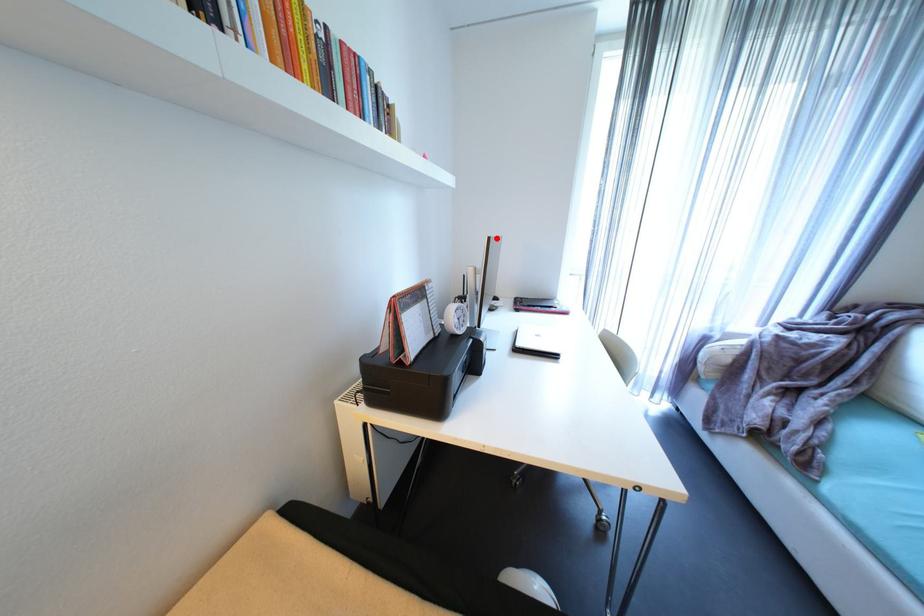
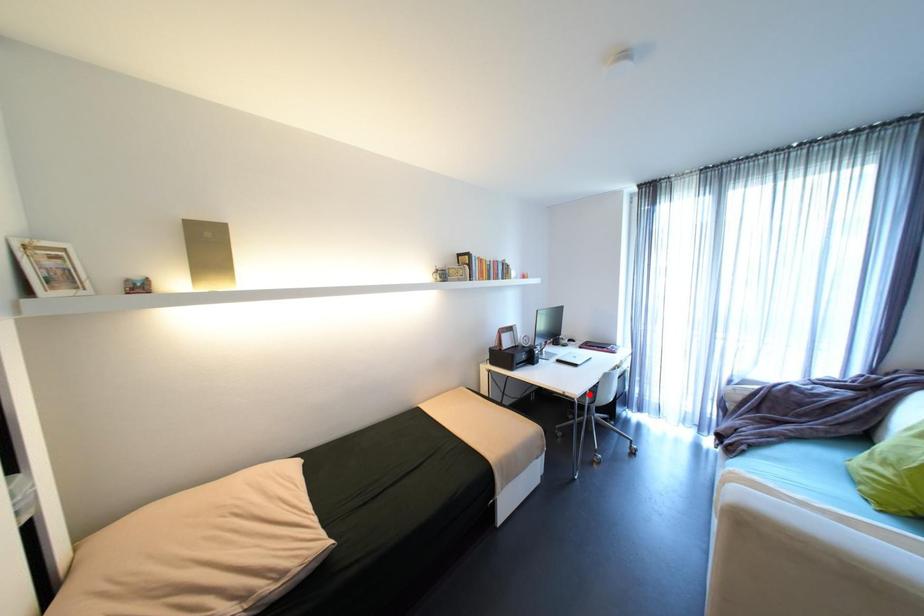
I am providing you with two images of the same scene from different viewpoints. A red point is marked on the first image and another point is marked on the second image. Does the point marked in image1 correspond to the same location as the one in image2?

No